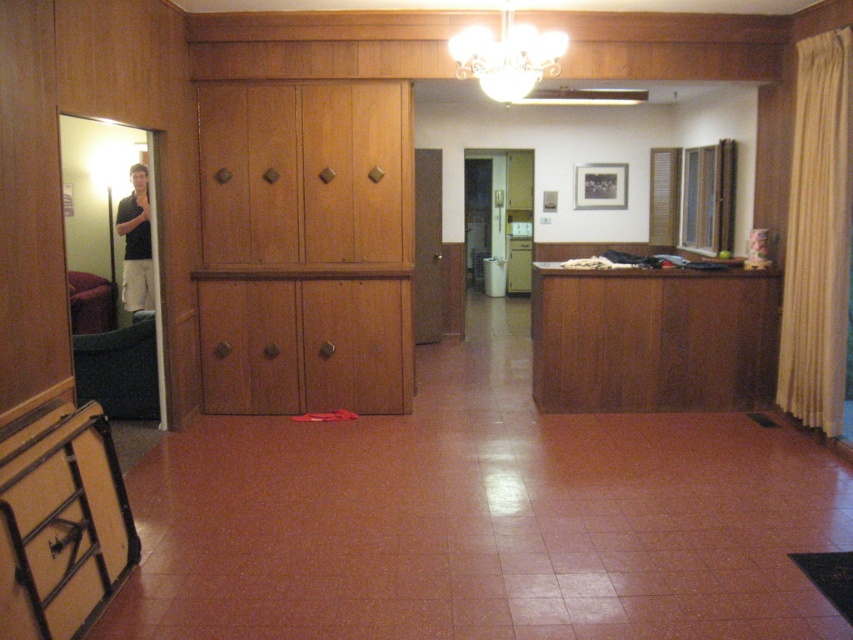
Between wooden dresser at center and white glass chandelier at upper center, which one has more height?

wooden dresser at center

The height and width of the screenshot is (640, 853). Describe the element at coordinates (305, 246) in the screenshot. I see `wooden dresser at center` at that location.

Does point (337, 160) come behind point (550, 68)?

Yes, it is behind point (550, 68).

Identify the location of wooden dresser at center. This screenshot has width=853, height=640. (305, 246).

Is wooden dresser at center to the right of matte black drawer at lower left from the viewer's perspective?

Yes, wooden dresser at center is to the right of matte black drawer at lower left.

In the scene shown: Does wooden dresser at center appear on the left side of matte black drawer at lower left?

In fact, wooden dresser at center is to the right of matte black drawer at lower left.

What are the coordinates of `wooden dresser at center` in the screenshot? It's located at (305, 246).

Does matte black drawer at lower left have a lesser width compared to beige fabric curtain at right?

No, matte black drawer at lower left is not thinner than beige fabric curtain at right.

How far apart are matte black drawer at lower left and beige fabric curtain at right?

3.65 meters

Where is `matte black drawer at lower left`? The height and width of the screenshot is (640, 853). matte black drawer at lower left is located at coordinates (62, 529).